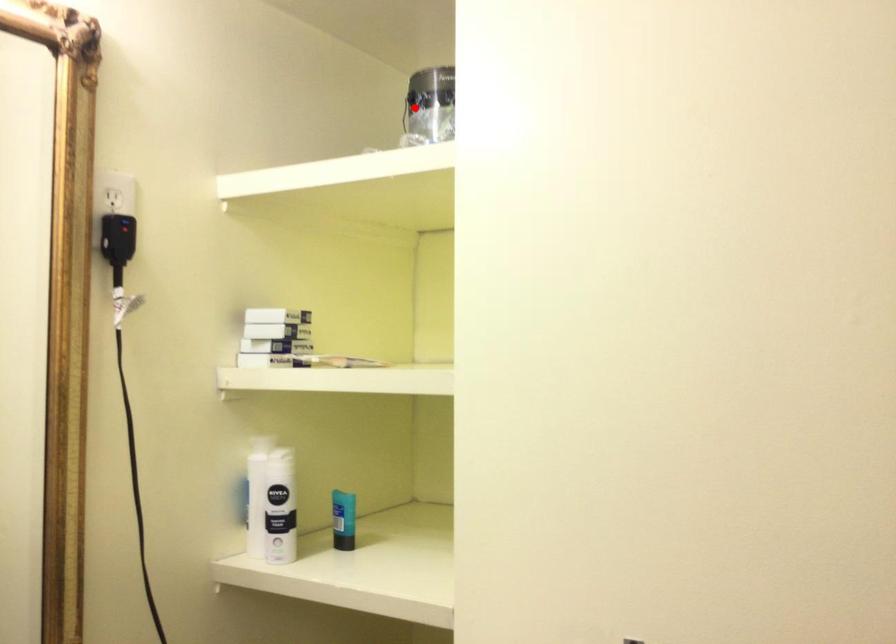
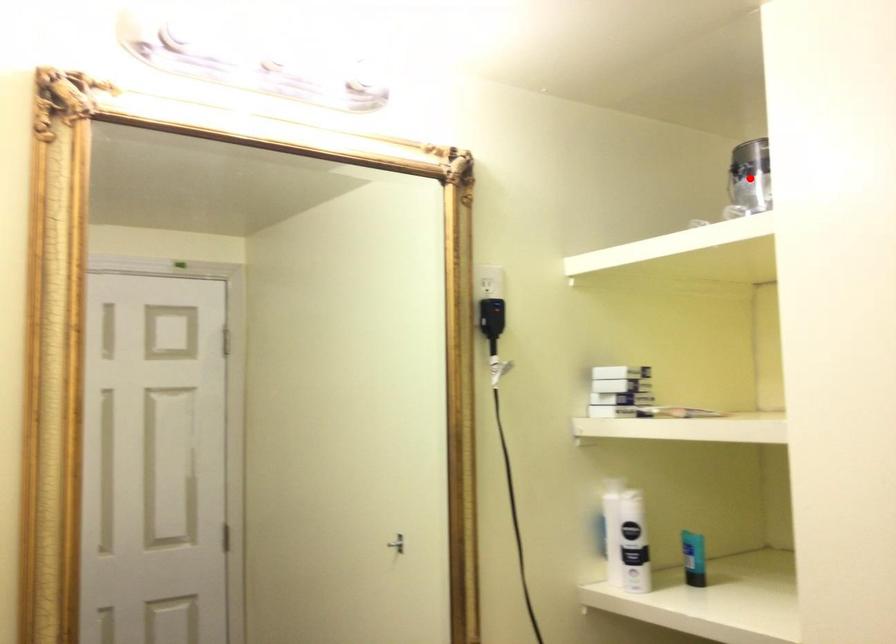
In the scene shown: I am providing you with two images of the same scene from different viewpoints. A red point is marked on the first image and another point is marked on the second image. Is the red point in image1 aligned with the point shown in image2?

Yes